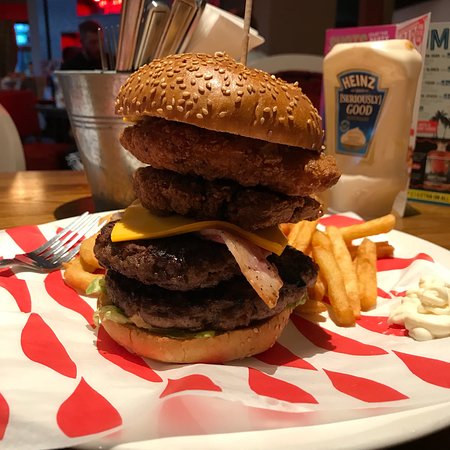
At what (x,y) coordinates should I click in order to perform the action: click on glass. Please return your answer as a coordinate pair (x, y). The image size is (450, 450). Looking at the image, I should click on (367, 167).